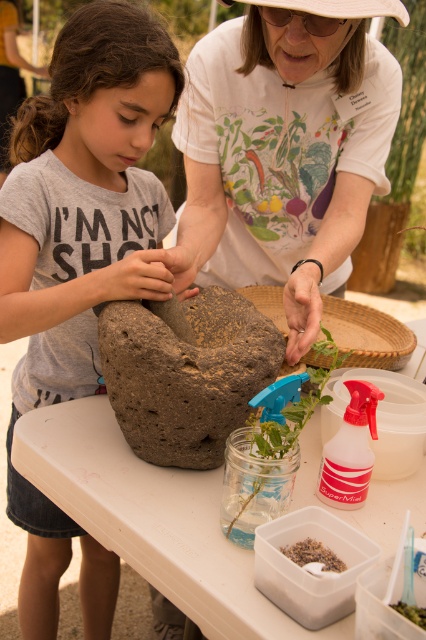
Which is below, white cotton shirt at upper center or brown rough stone at center?

brown rough stone at center is below.

Is white cotton shirt at upper center wider than brown rough stone at center?

Indeed, white cotton shirt at upper center has a greater width compared to brown rough stone at center.

Does point (233, 195) come behind point (166, 378)?

Yes, it is.

This screenshot has width=426, height=640. I want to click on white cotton shirt at upper center, so click(284, 150).

Can you confirm if brown matte rock at center is positioned to the right of brown rough stone at center?

No, brown matte rock at center is not to the right of brown rough stone at center.

Is brown matte rock at center shorter than brown rough stone at center?

Incorrect, brown matte rock at center's height does not fall short of brown rough stone at center's.

Is point (14, 230) in front of point (111, 380)?

No, (14, 230) is behind (111, 380).

Locate an element on the screen. The image size is (426, 640). brown matte rock at center is located at coordinates (80, 259).

Describe the element at coordinates (152, 518) in the screenshot. I see `white plastic table at center` at that location.

Between white plastic table at center and translucent glass jar at center, which one appears on the left side from the viewer's perspective?

From the viewer's perspective, white plastic table at center appears more on the left side.

The height and width of the screenshot is (640, 426). I want to click on white plastic table at center, so (152, 518).